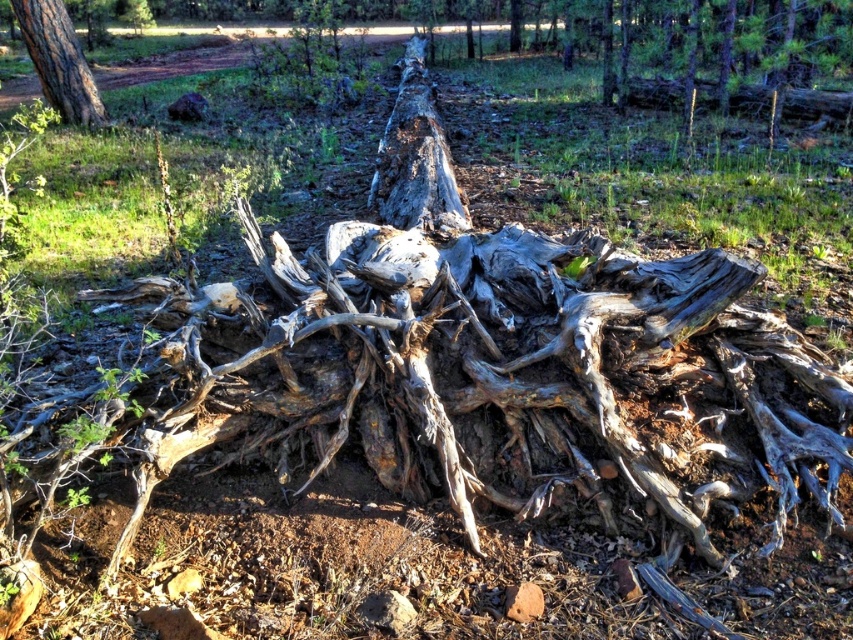
Question: Does gray rough bark tree trunk at center appear over gray rough bark tree trunk at upper left?

Choices:
 (A) no
 (B) yes

Answer: (A)

Question: Which point is closer to the camera taking this photo?

Choices:
 (A) (457, 220)
 (B) (42, 35)

Answer: (A)

Question: Which of the following is the farthest from the observer?

Choices:
 (A) gray rough bark tree trunk at center
 (B) gray rough bark tree trunk at upper left

Answer: (B)

Question: Can you confirm if gray rough bark tree trunk at center is thinner than gray rough bark tree trunk at upper left?

Choices:
 (A) no
 (B) yes

Answer: (B)

Question: Can you confirm if gray rough bark tree trunk at center is bigger than gray rough bark tree trunk at upper left?

Choices:
 (A) no
 (B) yes

Answer: (B)

Question: Which point is farther from the camera taking this photo?

Choices:
 (A) (424, 112)
 (B) (70, 99)

Answer: (B)